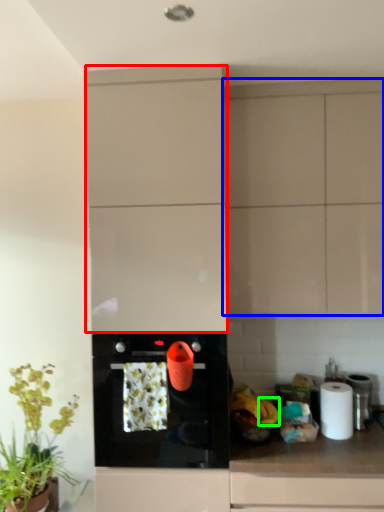
Question: Which object is the closest to the cabinetry (highlighted by a red box)? Choose among these: cabinetry (highlighted by a blue box) or banana (highlighted by a green box).

Choices:
 (A) cabinetry
 (B) banana

Answer: (A)